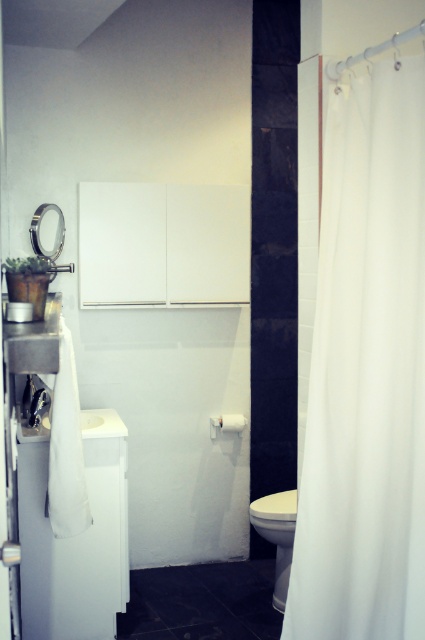
Can you confirm if white fabric shower curtain at right is positioned to the right of white glossy toilet bowl at lower center?

Indeed, white fabric shower curtain at right is positioned on the right side of white glossy toilet bowl at lower center.

Does white fabric shower curtain at right appear under white glossy toilet bowl at lower center?

No.

Between point (376, 573) and point (289, 561), which one is positioned behind?

Point (289, 561)

Find the location of `white fabric shower curtain at right`. white fabric shower curtain at right is located at coordinates (365, 371).